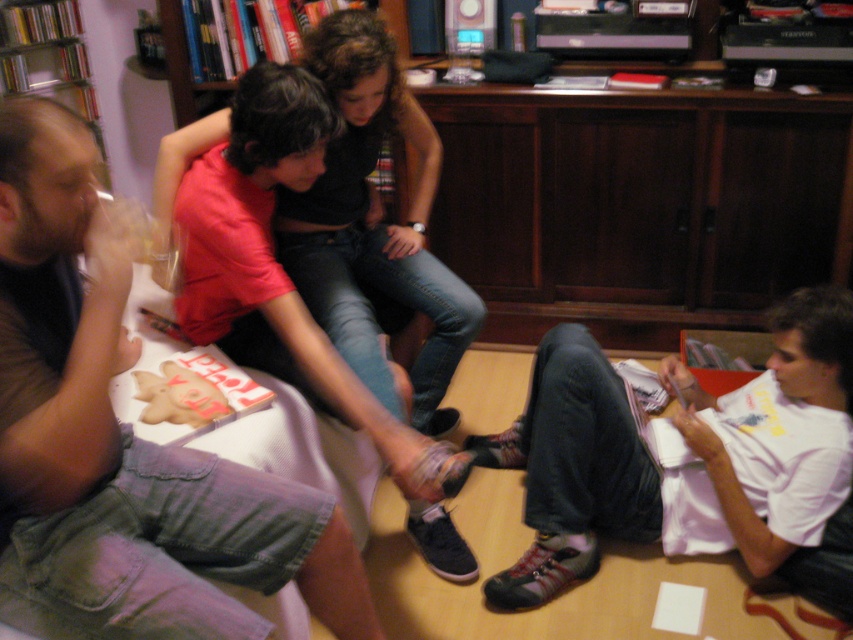
In the scene shown: You are a photographer trying to capture a candid shot of the two people in the scene. The white fabric shirt at lower right and the matte red shirt at center are your subjects. Since you want to ensure both are in focus, you need to know their heights relative to each other. Which subject is shorter?

The white fabric shirt at lower right is shorter than the matte red shirt at center, so you should adjust your focus to account for their differing heights.

You are trying to locate the person wearing the denim shorts at left and the person in the matte red shirt at center. Based on their positions, which one is closer to the left side of the room?

The denim shorts at left is positioned on the left side of matte red shirt at center, so the person wearing denim shorts at left is closer to the left side of the room.

You are standing in the living room and want to hand a drink to the person wearing the denim shorts at left and the person wearing the white fabric shirt at lower right. Which person should you approach first if you want to reach the closest one to you?

The denim shorts at left is closer to the viewer than the white fabric shirt at lower right, so you should approach the person wearing the denim shorts at left first.